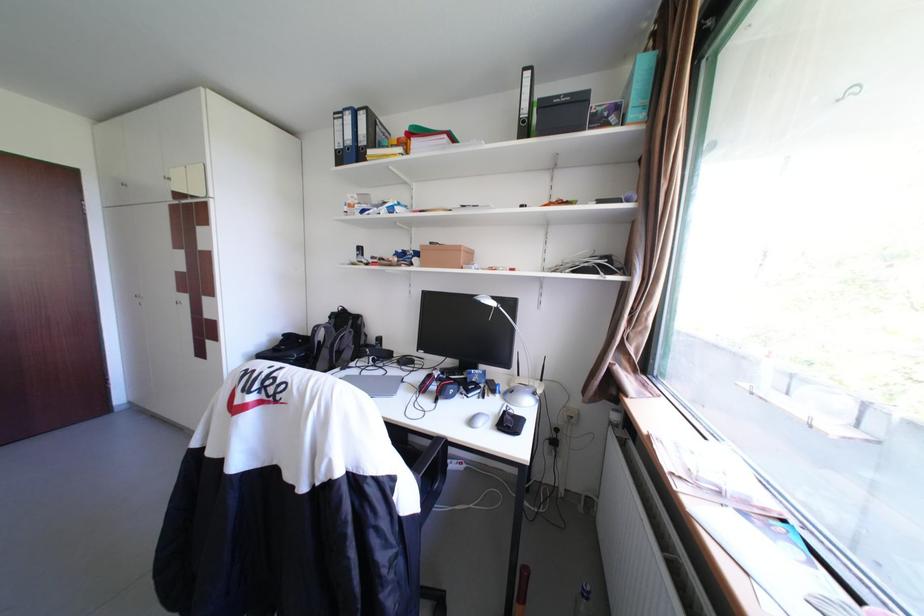
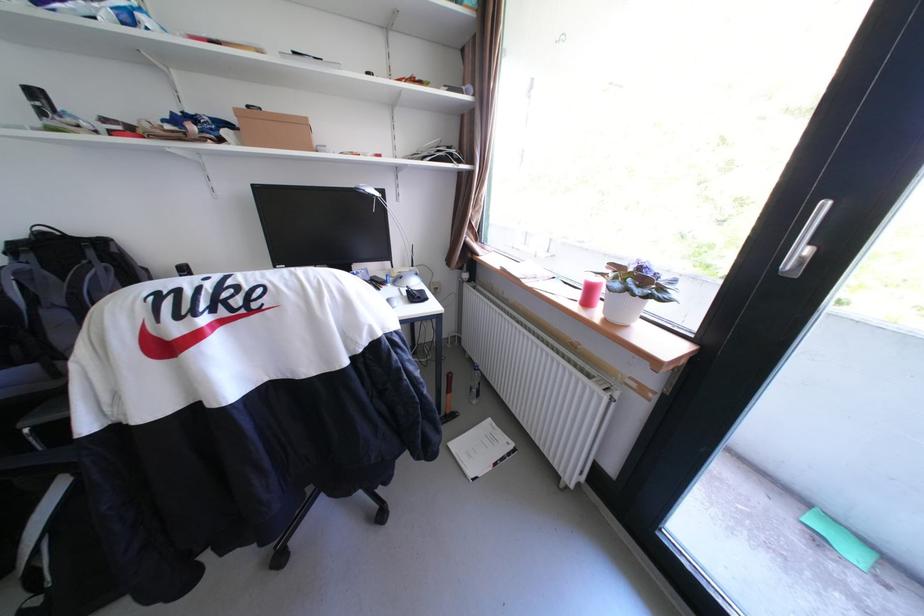
Question: I am providing you with two images of the same scene from different viewpoints. Which of the following objects are not visible in image2?

Choices:
 (A) gray folded cushion
 (B) red headphones
 (C) green sponge
 (D) cardboard box

Answer: (B)